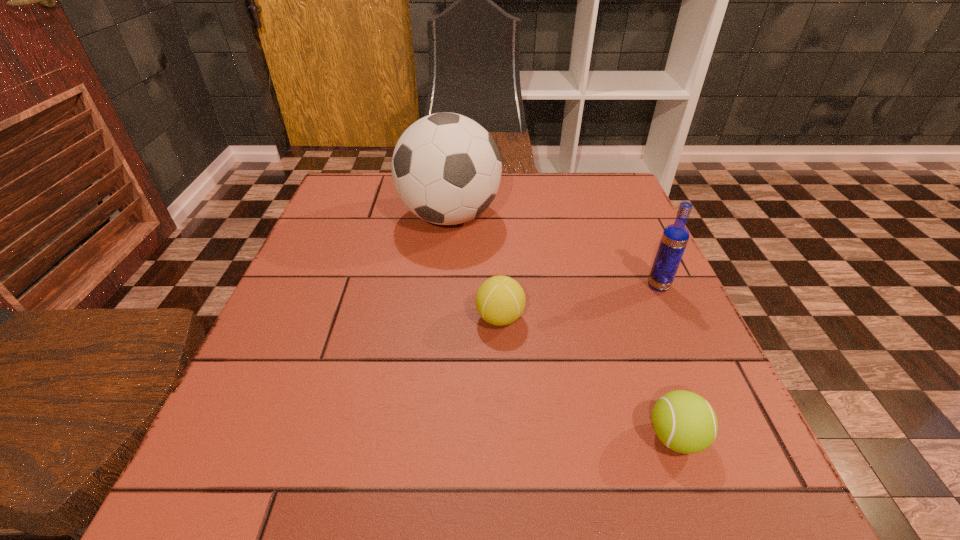
This screenshot has width=960, height=540. Identify the location of free space between the second object from right to left and the third nearest object. (667, 361).

The image size is (960, 540). In order to click on free spot between the soccer ball and the left tennis ball in this screenshot , I will do `click(474, 267)`.

Locate an element on the screen. free area in between the left tennis ball and the rightmost object is located at coordinates (579, 302).

Identify the location of empty location between the soccer ball and the right tennis ball. (563, 327).

Where is `object that is the third nearest to the vodka`? This screenshot has height=540, width=960. object that is the third nearest to the vodka is located at coordinates (446, 168).

Identify which object is located as the nearest to the farthest object. Please provide its 2D coordinates. Your answer should be formatted as a tuple, i.e. [(x, y)], where the tuple contains the x and y coordinates of a point satisfying the conditions above.

[(500, 300)]

Locate an element on the screen. This screenshot has width=960, height=540. free space that satisfies the following two spatial constraints: 1. on the front side of the nearer tennis ball; 2. on the right side of the farthest object is located at coordinates (428, 437).

I want to click on free location that satisfies the following two spatial constraints: 1. on the front side of the farthest object; 2. on the left side of the third nearest object, so click(x=443, y=286).